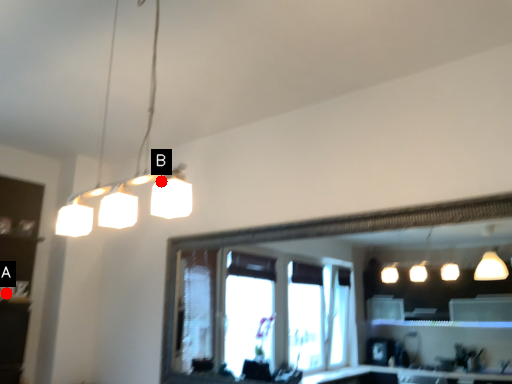
Question: Two points are circled on the image, labeled by A and B beside each circle. Among these points, which one is farthest from the camera?

Choices:
 (A) A is further
 (B) B is further

Answer: (A)